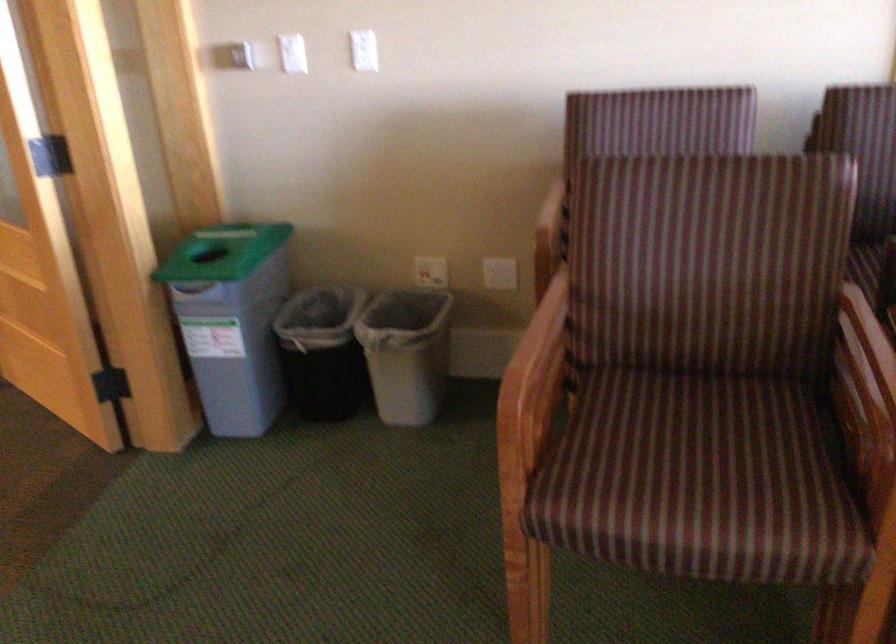
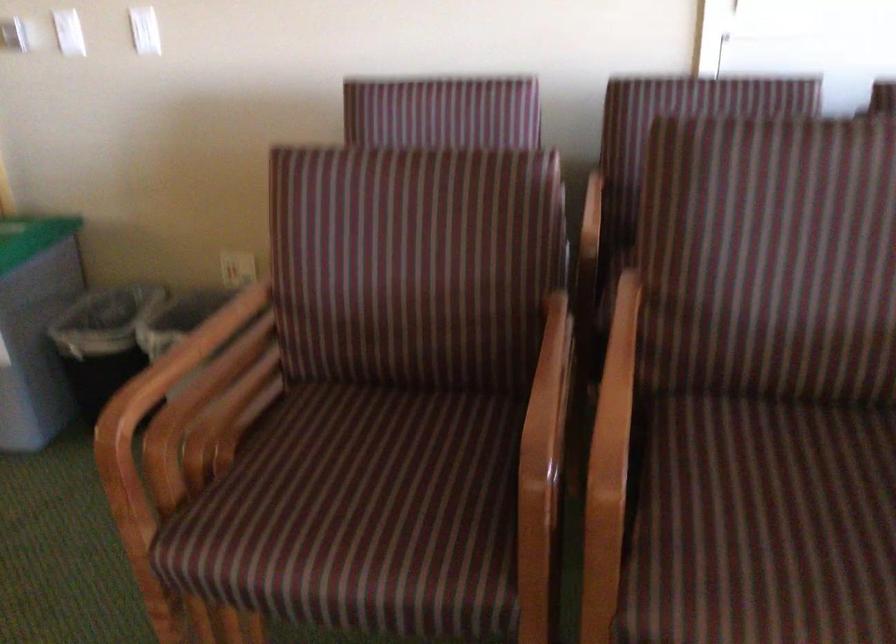
In a continuous first-person perspective shot, in which direction is the camera moving?

The cameraman walked toward right, forward.